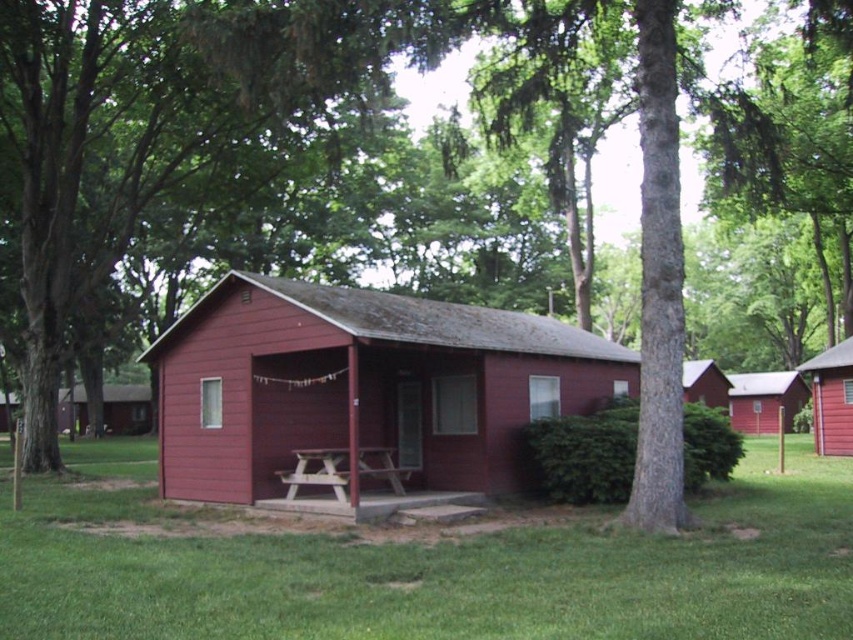
Question: Considering the real-world distances, which object is closest to the smooth wooden cabin at center?

Choices:
 (A) matte red cabin at center
 (B) matte wood cabin at center
 (C) smooth red cabin at center
 (D) matte red cabin at right

Answer: (C)

Question: Observing the image, what is the correct spatial positioning of matte wood cabin at center in reference to wooden picnic table at center?

Choices:
 (A) below
 (B) above

Answer: (B)

Question: Can you confirm if matte wood cabin at center is positioned to the right of smooth wooden cabin at center?

Choices:
 (A) yes
 (B) no

Answer: (B)

Question: Which point is closer to the camera?

Choices:
 (A) matte red cabin at center
 (B) smooth wooden cabin at center
 (C) smooth red cabin at center
 (D) matte wood cabin at center

Answer: (C)

Question: Considering the real-world distances, which object is farthest from the matte wood cabin at center?

Choices:
 (A) matte red cabin at right
 (B) smooth red cabin at center
 (C) matte red cabin at center
 (D) green grass at lower center

Answer: (C)

Question: Can you confirm if matte red cabin at right is positioned to the left of smooth wooden cabin at center?

Choices:
 (A) yes
 (B) no

Answer: (A)